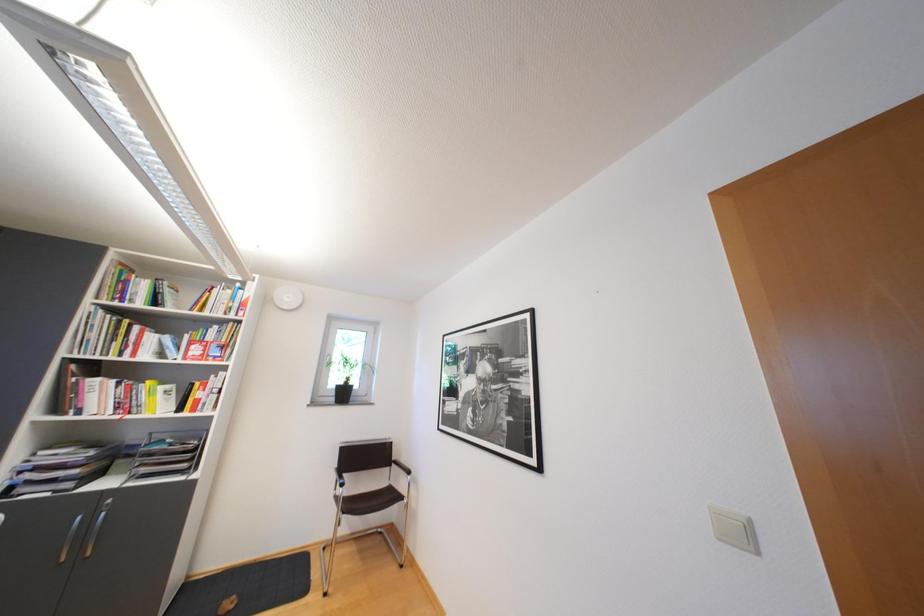
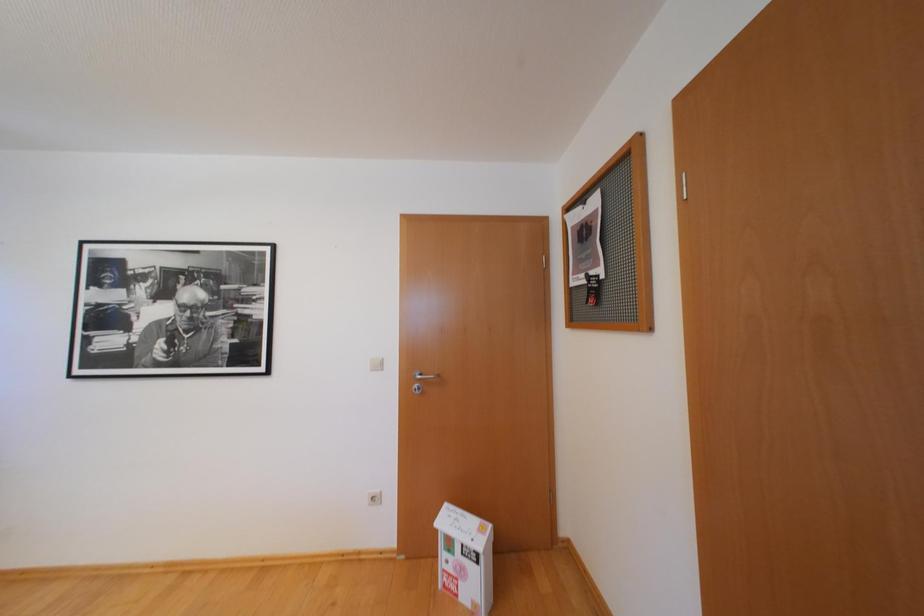
Question: The camera is either moving clockwise (left) or counter-clockwise (right) around the object. The first image is from the beginning of the video and the second image is from the end. Is the camera moving left or right when shooting the video?

Choices:
 (A) Left
 (B) Right

Answer: (A)